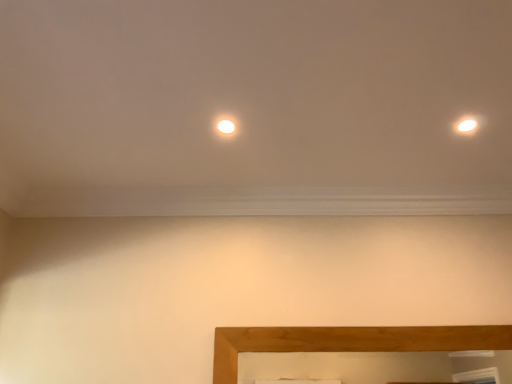
Question: Considering the relative sizes of wooden picture frame at lower center and white glossy light at upper right in the image provided, is wooden picture frame at lower center thinner than white glossy light at upper right?

Choices:
 (A) yes
 (B) no

Answer: (A)

Question: Is wooden picture frame at lower center beside white glossy light at upper right?

Choices:
 (A) no
 (B) yes

Answer: (A)

Question: Is wooden picture frame at lower center positioned beyond the bounds of white glossy light at upper right?

Choices:
 (A) yes
 (B) no

Answer: (A)

Question: From the image's perspective, does wooden picture frame at lower center appear lower than white glossy light at upper right?

Choices:
 (A) yes
 (B) no

Answer: (A)

Question: Is white glossy light at upper right surrounded by wooden picture frame at lower center?

Choices:
 (A) yes
 (B) no

Answer: (B)

Question: In terms of height, does matte white light at center look taller or shorter compared to white glossy light at upper right?

Choices:
 (A) tall
 (B) short

Answer: (B)

Question: In the image, is matte white light at center positioned in front of or behind white glossy light at upper right?

Choices:
 (A) front
 (B) behind

Answer: (B)

Question: Is point (222, 130) positioned closer to the camera than point (468, 114)?

Choices:
 (A) closer
 (B) farther

Answer: (B)

Question: Looking at the image, does matte white light at center seem bigger or smaller compared to white glossy light at upper right?

Choices:
 (A) big
 (B) small

Answer: (B)

Question: From the image's perspective, is wooden picture frame at lower center above or below white glossy light at upper right?

Choices:
 (A) below
 (B) above

Answer: (A)

Question: Does point (225, 357) appear closer or farther from the camera than point (470, 135)?

Choices:
 (A) farther
 (B) closer

Answer: (A)

Question: Is wooden picture frame at lower center situated inside white glossy light at upper right or outside?

Choices:
 (A) outside
 (B) inside

Answer: (A)

Question: In terms of width, does wooden picture frame at lower center look wider or thinner when compared to white glossy light at upper right?

Choices:
 (A) wide
 (B) thin

Answer: (B)

Question: From their relative heights in the image, would you say matte white light at center is taller or shorter than wooden picture frame at lower center?

Choices:
 (A) tall
 (B) short

Answer: (B)

Question: Considering their positions, is matte white light at center located in front of or behind wooden picture frame at lower center?

Choices:
 (A) behind
 (B) front

Answer: (B)